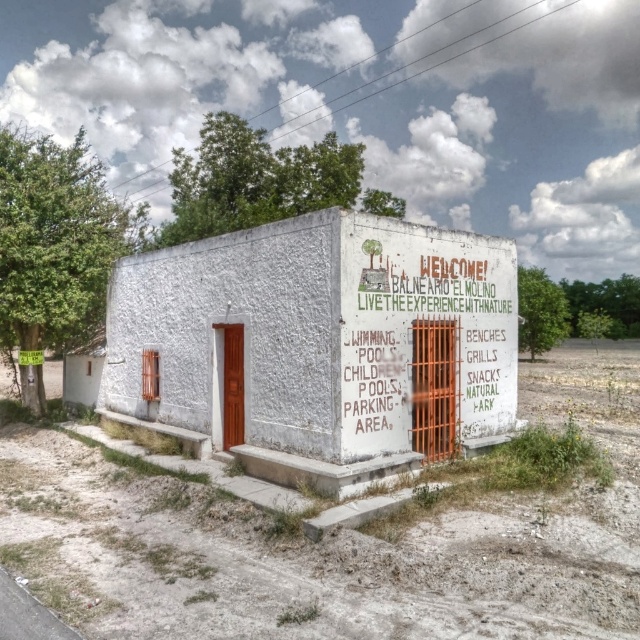
You are standing in front of the building and notice a point on the wall. What is located at the coordinates point (320, 344)?

At point (320, 344) lies the white stucco sign at center.

In the scene shown: You are standing in front of the building and want to read both the white stucco sign at center and the white painted signboard at center. How far apart are they from each other?

The white stucco sign at center is 5.81 feet away from the white painted signboard at center.